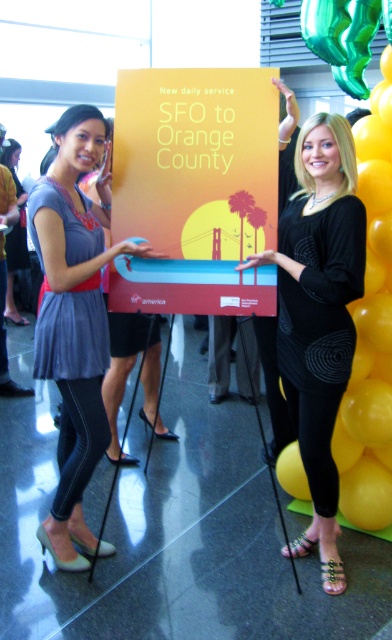
What is the exact coordinate of the black matte dress at center?

The black matte dress at center is located at coordinate point (319, 314).

You are an event planner organizing a promotional event. You need to decide which item to place in a display case that can only accommodate items smaller than the other. Which object should you choose between the black matte dress at center and the yellow glossy balloon at upper right?

The black matte dress at center is smaller than the yellow glossy balloon at upper right, so you should choose the black matte dress at center for the display case.

You are a photographer standing at the center of the scene. You want to take a photo of the matte gray dress at center and the yellow glossy balloon at upper right. If your camera has a maximum focus distance of 1.2 meters, will both objects be in focus?

The matte gray dress at center is 1.24 meters from yellow glossy balloon at upper right. Since the distance between them exceeds the camera maximum focus distance of 1.2 meters, both objects may not be in focus simultaneously.